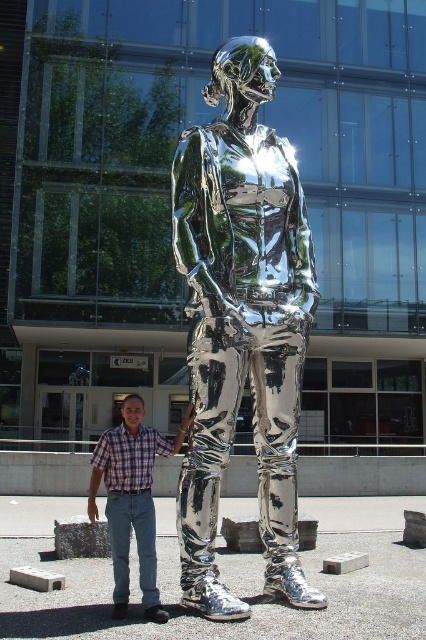
You are a photographer trying to capture a photo where the plaid shirt at center and the shiny metallic figure at center are touching each other. Given their current distance, is this possible without moving either object?

The shiny metallic figure at center and plaid shirt at center are 4.20 feet apart from each other, so it is not possible to capture them touching without moving either object since the distance is too large.

You are a photographer adjusting your camera settings to capture the reflection on the shiny metallic figure at center. To ensure the plaid shirt at center is visible in the reflection, where should you position yourself relative to the sculpture?

The shiny metallic figure at center is positioned over plaid shirt at center, so positioning yourself directly in front of the sculpture facing the plaid shirt at center will allow the reflection to include the shirt.

You are standing in front of the sculpture and see the point at coordinates point (241, 323). Where exactly is this point located on the sculpture?

The point (241, 323) is on the shiny metallic figure at center.